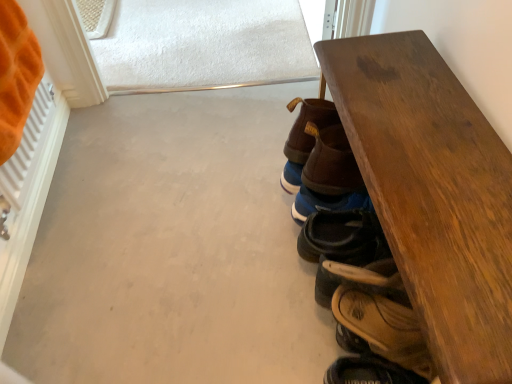
Question: From a real-world perspective, is brown leather shoe at center, marked as the first footwear in a top-to-bottom arrangement, beneath brown leather sandal at lower right, which ranks as the 4th footwear in top-to-bottom order?

Choices:
 (A) yes
 (B) no

Answer: (B)

Question: Is brown leather shoe at center, marked as the first footwear in a top-to-bottom arrangement, far from brown leather sandal at lower right, which ranks as the 4th footwear in top-to-bottom order?

Choices:
 (A) no
 (B) yes

Answer: (A)

Question: From the image's perspective, is brown leather shoe at center, marked as the first footwear in a top-to-bottom arrangement, located above brown leather sandal at lower right, acting as the 1th footwear starting from the bottom?

Choices:
 (A) no
 (B) yes

Answer: (B)

Question: Is brown leather shoe at center, marked as the first footwear in a top-to-bottom arrangement, at the right side of brown leather sandal at lower right, acting as the 1th footwear starting from the bottom?

Choices:
 (A) no
 (B) yes

Answer: (A)

Question: Considering the relative sizes of brown leather shoe at center, marked as the first footwear in a top-to-bottom arrangement, and brown leather sandal at lower right, acting as the 1th footwear starting from the bottom, in the image provided, is brown leather shoe at center, marked as the first footwear in a top-to-bottom arrangement, shorter than brown leather sandal at lower right, acting as the 1th footwear starting from the bottom,?

Choices:
 (A) no
 (B) yes

Answer: (A)

Question: Can you confirm if brown leather shoe at center, marked as the fourth footwear in a bottom-to-top arrangement, is positioned to the left of brown leather sandal at lower right, which ranks as the 4th footwear in top-to-bottom order?

Choices:
 (A) yes
 (B) no

Answer: (A)

Question: Can you confirm if blue suede shoes at lower right, the 3th footwear from the bottom, is shorter than wooden table at right?

Choices:
 (A) yes
 (B) no

Answer: (A)

Question: Is wooden table at right surrounded by blue suede shoes at lower right, which ranks as the 2th footwear in top-to-bottom order?

Choices:
 (A) yes
 (B) no

Answer: (B)

Question: Are blue suede shoes at lower right, the 3th footwear from the bottom, and wooden table at right far apart?

Choices:
 (A) no
 (B) yes

Answer: (A)

Question: From the image's perspective, is blue suede shoes at lower right, which ranks as the 2th footwear in top-to-bottom order, located above wooden table at right?

Choices:
 (A) yes
 (B) no

Answer: (A)

Question: Is blue suede shoes at lower right, the 3th footwear from the bottom, facing away from wooden table at right?

Choices:
 (A) yes
 (B) no

Answer: (A)

Question: From a real-world perspective, is blue suede shoes at lower right, which ranks as the 2th footwear in top-to-bottom order, below wooden table at right?

Choices:
 (A) yes
 (B) no

Answer: (A)

Question: Can you confirm if wooden table at right is positioned to the left of brown leather sandal at lower right, acting as the 1th footwear starting from the bottom?

Choices:
 (A) yes
 (B) no

Answer: (B)